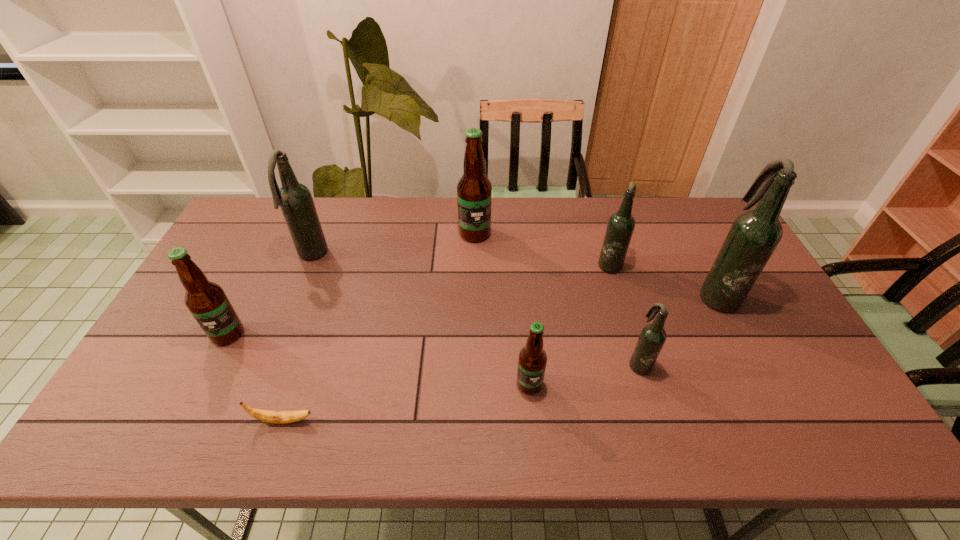
Locate which object is the fifth closest to the nearest dark beer bottle. Please provide its 2D coordinates. Your answer should be formatted as a tuple, i.e. [(x, y)], where the tuple contains the x and y coordinates of a point satisfying the conditions above.

[(279, 417)]

At what (x,y) coordinates should I click in order to perform the action: click on the third closest object to the shortest object. Please return your answer as a coordinate pair (x, y). Looking at the image, I should click on (295, 200).

Where is `beer bottle that stands as the fifth closest to the tallest object`? This screenshot has width=960, height=540. beer bottle that stands as the fifth closest to the tallest object is located at coordinates (295, 200).

You are a GUI agent. You are given a task and a screenshot of the screen. Output one action in this format:
    pyautogui.click(x=<x>, y=<y>)
    Task: Click on the beer bottle that is the fifth nearest to the fourth object from right to left
    Image resolution: width=960 pixels, height=540 pixels.
    Given the screenshot: What is the action you would take?
    pyautogui.click(x=295, y=200)

Image resolution: width=960 pixels, height=540 pixels. I want to click on dark beer bottle that is the second closest to the smallest dark beer bottle, so click(x=621, y=224).

Identify the location of the closest dark beer bottle to the fourth object from left to right. (621, 224).

Point out which brown beer bottle is positioned as the nearest to the rightmost brown beer bottle. Please provide its 2D coordinates. Your answer should be formatted as a tuple, i.e. [(x, y)], where the tuple contains the x and y coordinates of a point satisfying the conditions above.

[(474, 190)]

I want to click on the closest brown beer bottle to the shortest object, so coord(207,302).

The width and height of the screenshot is (960, 540). What are the coordinates of `vacant space that satisfies the following two spatial constraints: 1. on the label of the fourth farthest object; 2. on the right side of the third beer bottle from left to right` in the screenshot? It's located at coord(474,294).